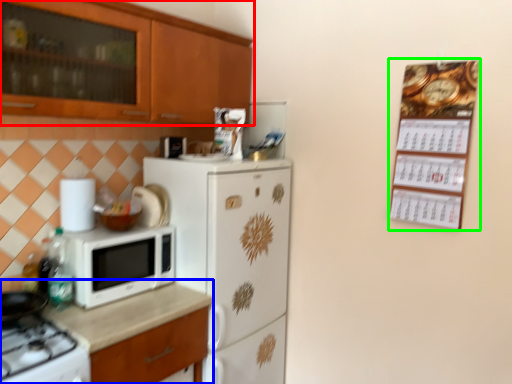
Question: Which object is positioned farthest from cabinetry (highlighted by a red box)? Select from countertop (highlighted by a blue box) and bulletin board (highlighted by a green box).

Choices:
 (A) countertop
 (B) bulletin board

Answer: (B)